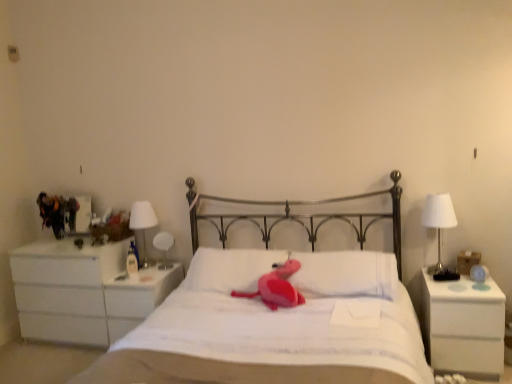
Question: Considering the positions of white glossy bedside lamp at left, the 1th bedside lamp in the back-to-front sequence, and white soft pillow at center, placed as the 2th pillow when sorted from right to left, in the image, is white glossy bedside lamp at left, the 1th bedside lamp in the back-to-front sequence, bigger or smaller than white soft pillow at center, placed as the 2th pillow when sorted from right to left,?

Choices:
 (A) small
 (B) big

Answer: (A)

Question: In the image, is white glossy bedside lamp at left, which is the second bedside lamp from front to back, positioned in front of or behind white soft pillow at center, placed as the 2th pillow when sorted from right to left?

Choices:
 (A) front
 (B) behind

Answer: (B)

Question: Based on their relative distances, which object is nearer to the white glossy bedside lamp at left, the 2th bedside lamp when ordered from right to left?

Choices:
 (A) white matte bed at center
 (B) white soft pillow at center, positioned as the 1th pillow in left-to-right order
 (C) white matte nightstand at right, the first nightstand when ordered from front to back
 (D) white glossy table lamp at right, the first bedside lamp from the front
 (E) white glossy table lamp at left

Answer: (E)

Question: Which of these objects is positioned closest to the white glossy table lamp at left?

Choices:
 (A) white soft pillow at center, which is the first pillow in right-to-left order
 (B) white matte bed at center
 (C) white glossy bedside lamp at left, which is the second bedside lamp from front to back
 (D) white soft pillow at center, positioned as the 1th pillow in left-to-right order
 (E) white glossy table lamp at right, the first bedside lamp when ordered from right to left

Answer: (C)